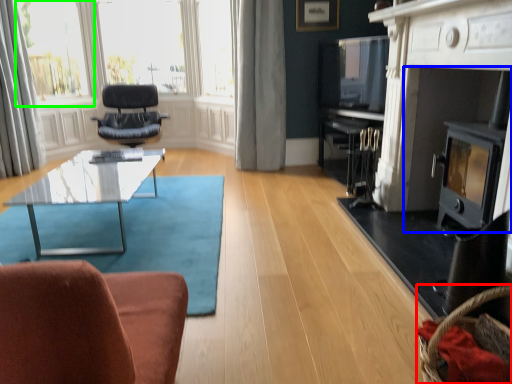
Question: Which is nearer to the basket (highlighted by a red box)? fireplace (highlighted by a blue box) or bay window (highlighted by a green box).

Choices:
 (A) fireplace
 (B) bay window

Answer: (A)